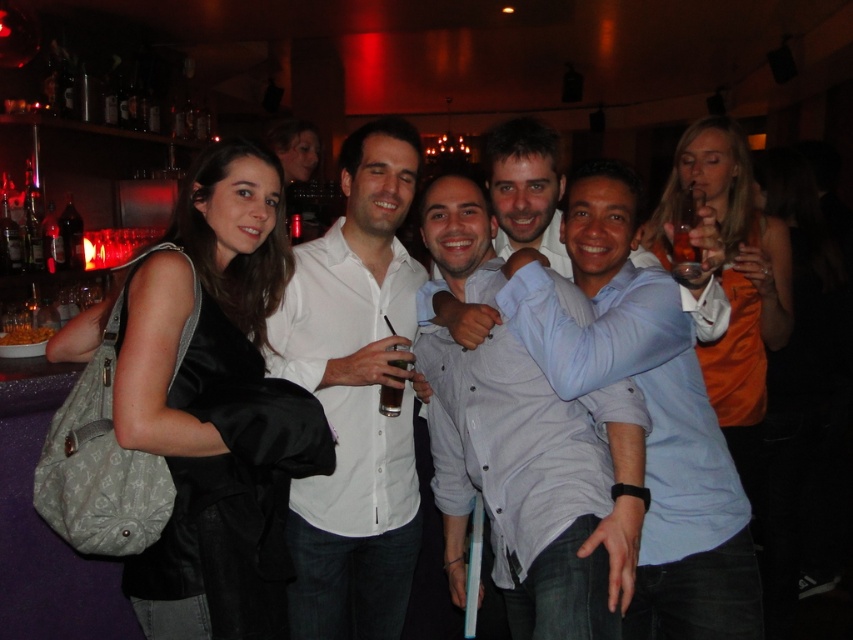
Does light blue shirt at center have a lesser width compared to translucent plastic cup at center?

No, light blue shirt at center is not thinner than translucent plastic cup at center.

Image resolution: width=853 pixels, height=640 pixels. What do you see at coordinates (543, 492) in the screenshot?
I see `light blue shirt at center` at bounding box center [543, 492].

Is point (451, 445) positioned before point (399, 403)?

No, (451, 445) is behind (399, 403).

Locate an element on the screen. light blue shirt at center is located at coordinates (543, 492).

Does white shirt at center appear on the right side of orange satin dress at right?

No, white shirt at center is not to the right of orange satin dress at right.

Looking at this image, does white shirt at center have a lesser width compared to orange satin dress at right?

Correct, white shirt at center's width is less than orange satin dress at right's.

Does point (341, 364) come closer to viewer compared to point (727, 289)?

That is True.

Find the location of a particular element. The width and height of the screenshot is (853, 640). white shirt at center is located at coordinates (355, 397).

Between point (231, 387) and point (456, 284), which one is positioned in front?

Point (231, 387)

Can you confirm if matte black jacket at left is positioned above light blue shirt at center?

No, matte black jacket at left is not above light blue shirt at center.

Between point (257, 627) and point (596, 496), which one is positioned in front?

Point (596, 496) is in front.

This screenshot has width=853, height=640. Find the location of `matte black jacket at left`. matte black jacket at left is located at coordinates (216, 404).